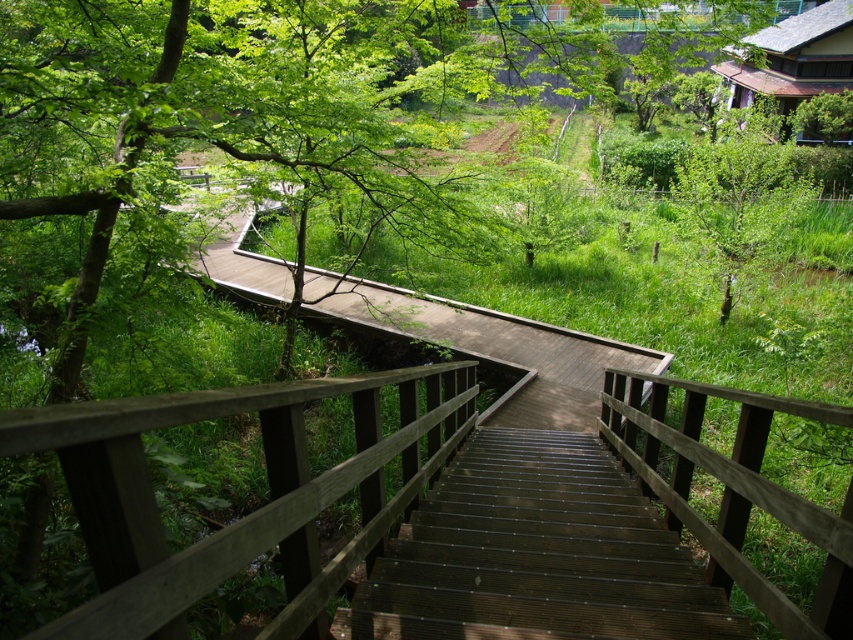
Between point (567, 576) and point (770, 170), which one is positioned in front?

Positioned in front is point (567, 576).

Which is above, dark brown wood stairs at center or green leafy tree at upper right?

green leafy tree at upper right is higher up.

Is point (526, 620) positioned behind point (699, 209)?

That is False.

This screenshot has height=640, width=853. I want to click on dark brown wood stairs at center, so click(537, 554).